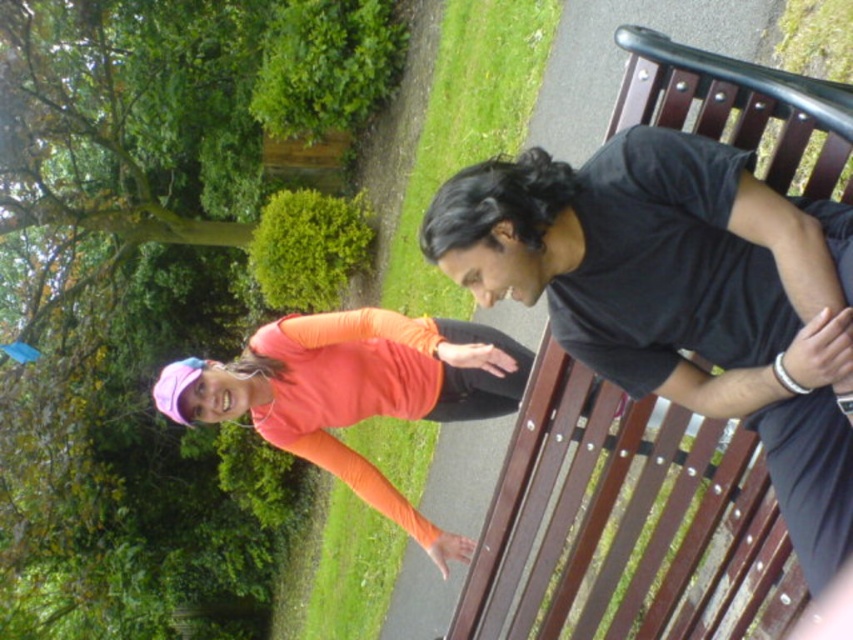
Question: Does brown wood bench at center come behind orange matte shirt at center?

Choices:
 (A) no
 (B) yes

Answer: (A)

Question: Which object appears farthest from the camera in this image?

Choices:
 (A) brown wood bench at center
 (B) orange matte shirt at center

Answer: (B)

Question: Which point appears closest to the camera in this image?

Choices:
 (A) (331, 321)
 (B) (717, 508)

Answer: (B)

Question: Which point appears farthest from the camera in this image?

Choices:
 (A) (694, 545)
 (B) (341, 339)

Answer: (B)

Question: Can you confirm if brown wood bench at center is positioned to the right of orange matte shirt at center?

Choices:
 (A) no
 (B) yes

Answer: (B)

Question: Does brown wood bench at center have a larger size compared to orange matte shirt at center?

Choices:
 (A) no
 (B) yes

Answer: (A)